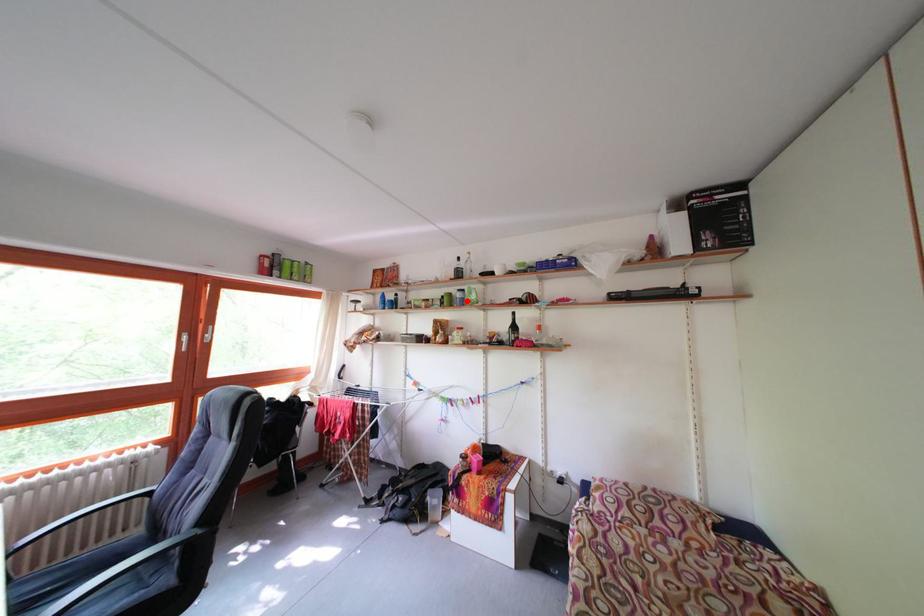
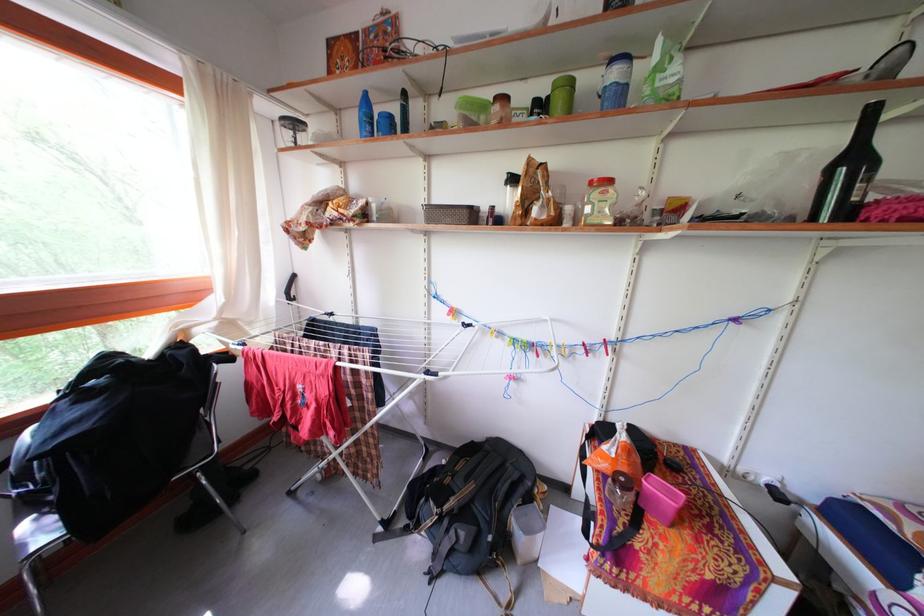
Find the pixel in the second image that matches the highlighted location in the first image.

(623, 81)